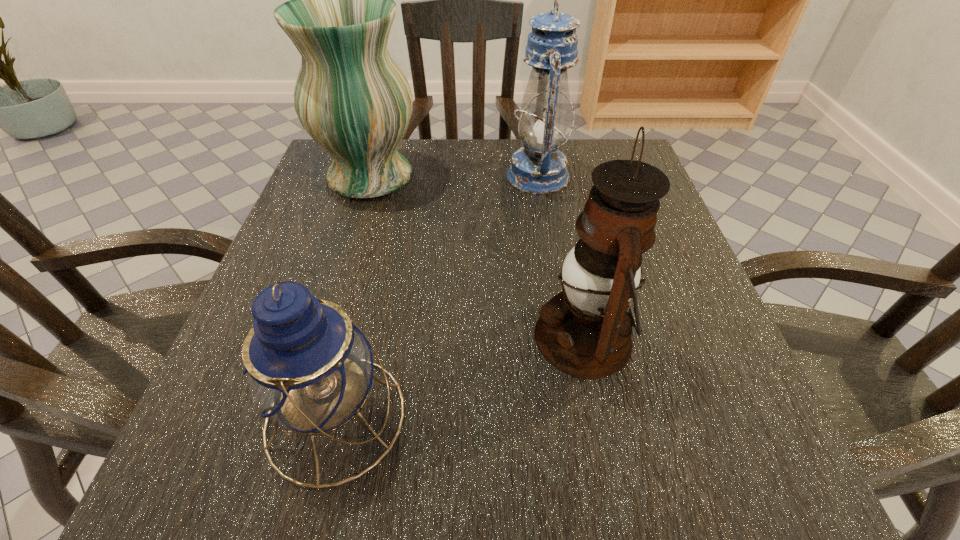
Locate an element on the screen. free region at the right edge of the desktop is located at coordinates (665, 238).

The width and height of the screenshot is (960, 540). I want to click on free region at the near left corner, so click(209, 496).

Image resolution: width=960 pixels, height=540 pixels. In the image, there is a desktop. In order to click on vacant space at the near right corner in this screenshot , I will do `click(714, 469)`.

Identify the location of free point between the farthest lantern and the vase. (454, 176).

The width and height of the screenshot is (960, 540). I want to click on empty location between the vase and the leftmost lantern, so click(353, 296).

The height and width of the screenshot is (540, 960). Find the location of `free space between the vase and the leftmost lantern`. free space between the vase and the leftmost lantern is located at coordinates (353, 296).

Find the location of a particular element. Image resolution: width=960 pixels, height=540 pixels. free point between the farthest lantern and the vase is located at coordinates (454, 176).

I want to click on unoccupied position between the leftmost lantern and the vase, so click(x=353, y=296).

Where is `object that is the third closest one to the shortest lantern`? object that is the third closest one to the shortest lantern is located at coordinates (539, 168).

Identify which object is the nearest to the leftmost lantern. Please provide its 2D coordinates. Your answer should be formatted as a tuple, i.e. [(x, y)], where the tuple contains the x and y coordinates of a point satisfying the conditions above.

[(585, 331)]